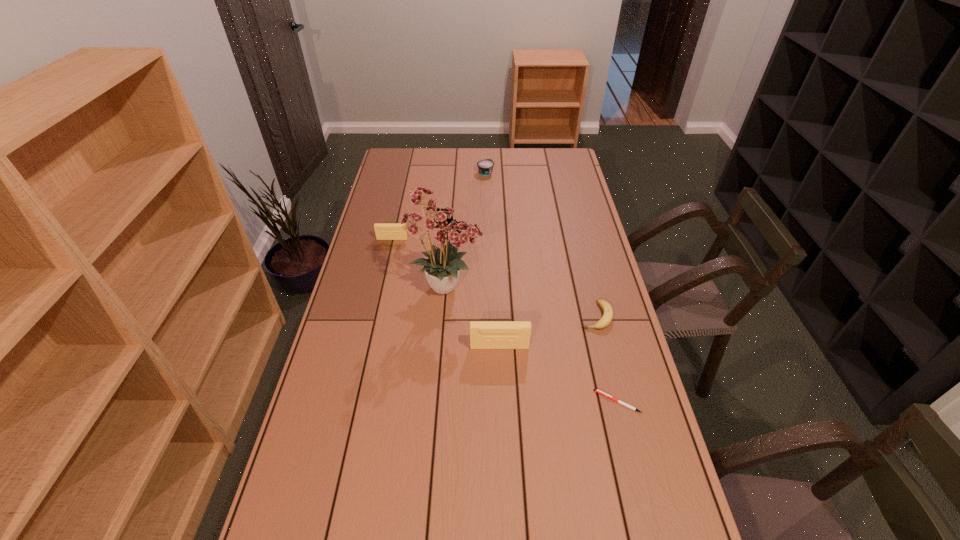
I want to click on the second farthest object, so click(384, 231).

Identify the location of the shorter videotape. The width and height of the screenshot is (960, 540). (384, 231).

Find the location of `the taller videotape`. the taller videotape is located at coordinates (483, 334).

Image resolution: width=960 pixels, height=540 pixels. Identify the location of the nearer videotape. (483, 334).

Identify the location of yogurt. (485, 167).

I want to click on the third shortest object, so click(x=485, y=167).

This screenshot has width=960, height=540. Identify the location of the tallest object. 439,225.

You are a GUI agent. You are given a task and a screenshot of the screen. Output one action in this format:
    pyautogui.click(x=<x>, y=<y>)
    Task: Click on the second shortest object
    The height and width of the screenshot is (540, 960).
    Given the screenshot: What is the action you would take?
    pyautogui.click(x=607, y=317)

You are a GUI agent. You are given a task and a screenshot of the screen. Output one action in this format:
    pyautogui.click(x=<x>, y=<y>)
    Task: Click on the pen
    
    Given the screenshot: What is the action you would take?
    pyautogui.click(x=596, y=390)

Locate an element on the screen. the shortest object is located at coordinates (596, 390).